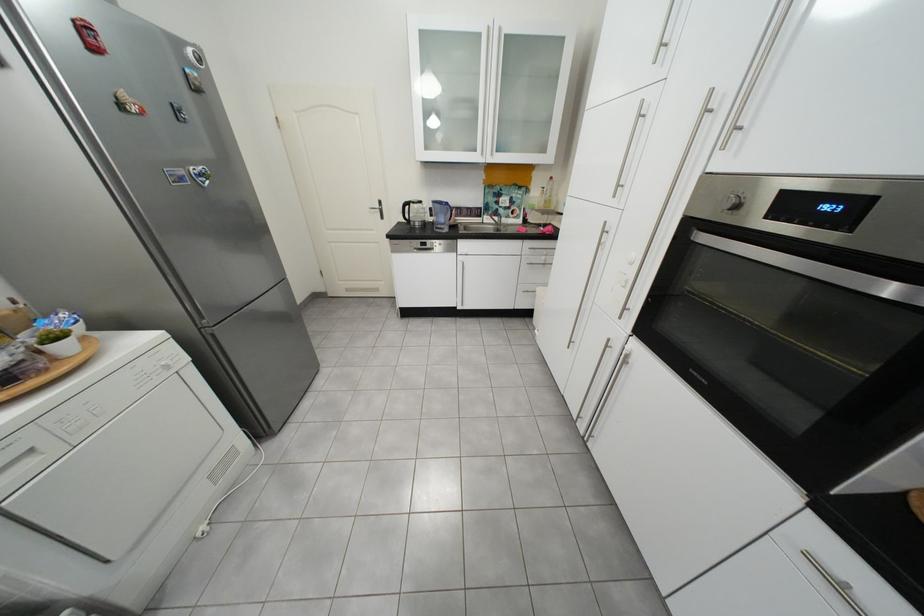
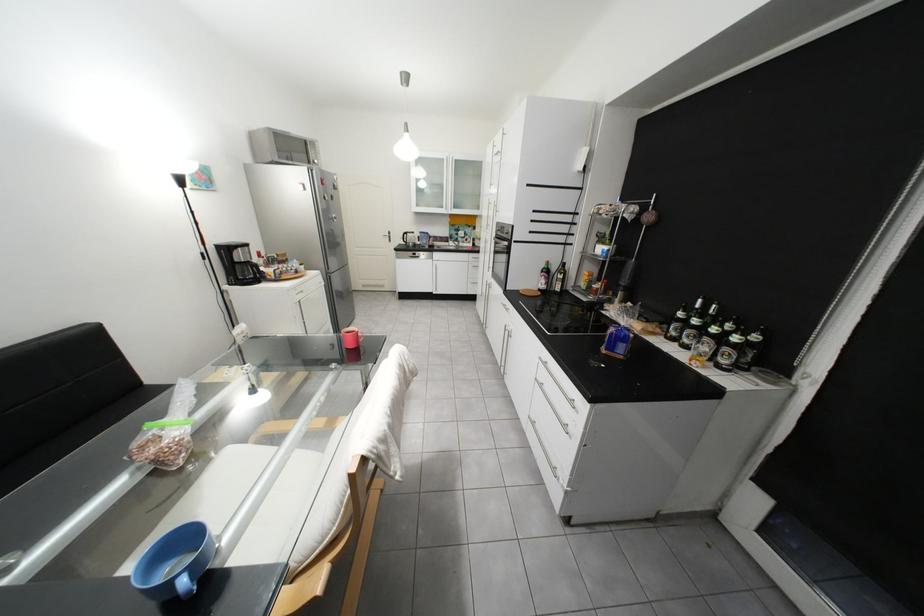
Locate, in the second image, the point that corresponds to (392,204) in the first image.

(402, 233)